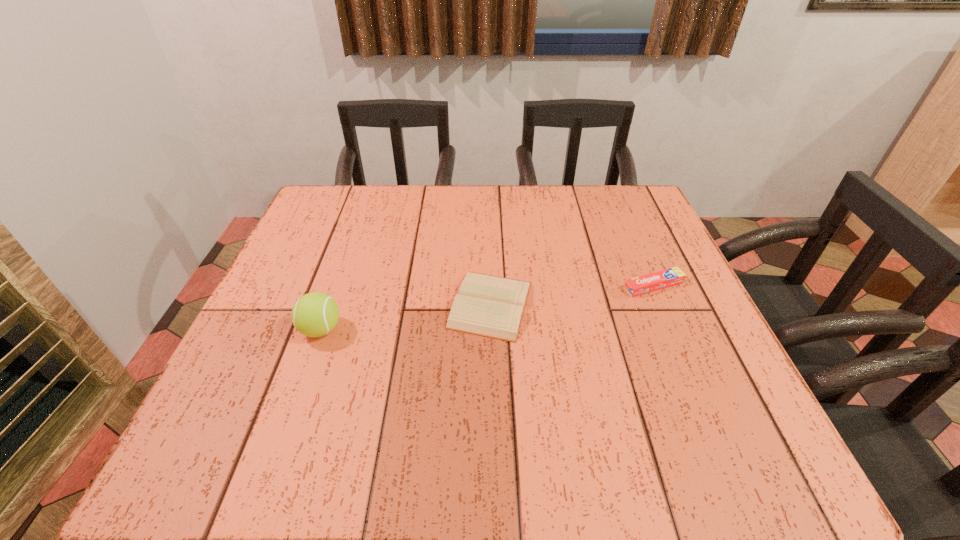
The image size is (960, 540). What are the coordinates of `free space between the toothpaste and the diary` in the screenshot? It's located at (572, 295).

Find the location of a particular element. free point between the tennis ball and the second object from right to left is located at coordinates (406, 317).

Identify the location of vacant point located between the diary and the rightmost object. This screenshot has height=540, width=960. (572, 295).

Where is `free space between the second object from right to left and the tennis ball`? free space between the second object from right to left and the tennis ball is located at coordinates (406, 317).

Identify the location of free space between the second object from right to left and the rightmost object. (572, 295).

This screenshot has width=960, height=540. Find the location of `the closest object to the diary`. the closest object to the diary is located at coordinates (666, 278).

Locate an element on the screen. This screenshot has width=960, height=540. object that stands as the closest to the toothpaste is located at coordinates (490, 306).

Where is `free space that satisfies the following two spatial constraints: 1. on the back side of the toothpaste; 2. on the left side of the second object from left to right`? This screenshot has height=540, width=960. free space that satisfies the following two spatial constraints: 1. on the back side of the toothpaste; 2. on the left side of the second object from left to right is located at coordinates (490, 286).